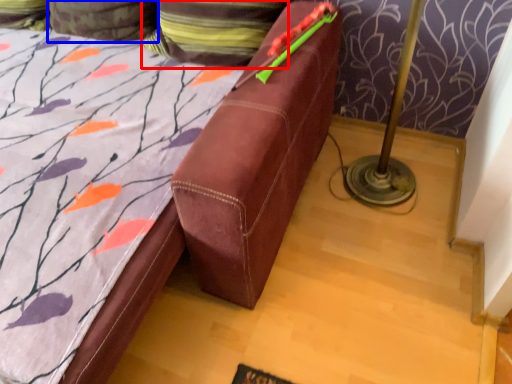
Question: Which point is further to the camera, pillow (highlighted by a red box) or pillow (highlighted by a blue box)?

Choices:
 (A) pillow
 (B) pillow

Answer: (B)